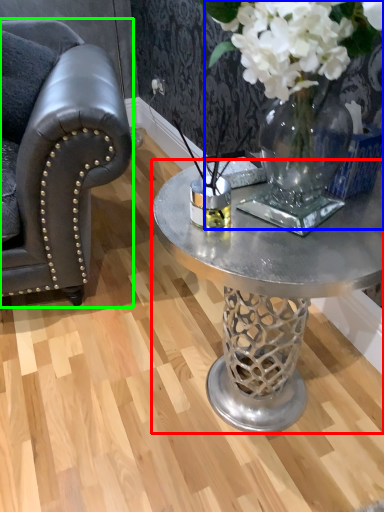
Question: Which object is the farthest from coffee table (highlighted by a red box)? Choose among these: floral arrangement (highlighted by a blue box) or chair (highlighted by a green box).

Choices:
 (A) floral arrangement
 (B) chair

Answer: (B)